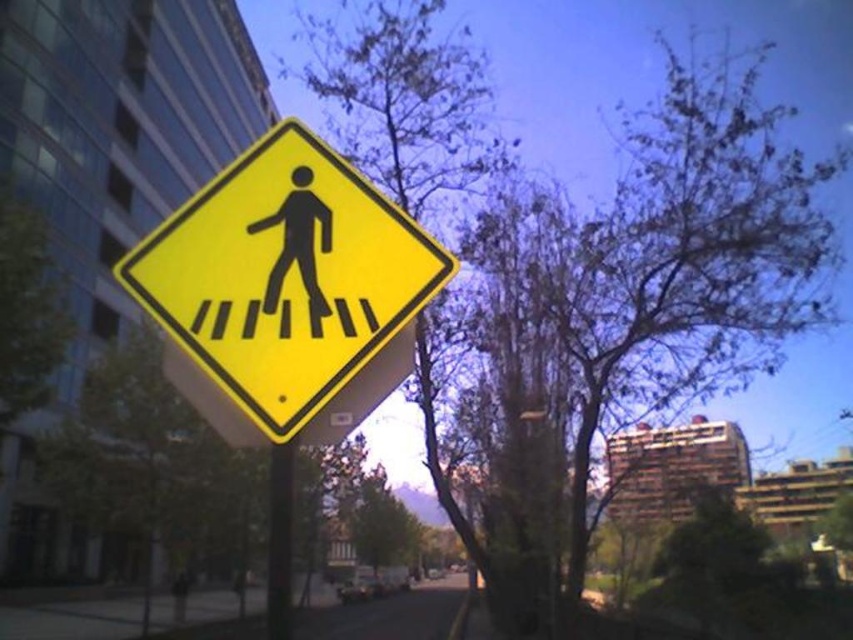
You are a pedestrian trying to cross the street and see the black silhouette at center on a yellow diamond sign. According to the sign, where should you walk to cross the street safely?

The black silhouette at center on the sign indicates the location of a designated pedestrian crossing area, so you should walk to that marked crossing to cross the street safely.

You are a city planner designing a new pedestrian sign. You have two objects in front of you, the black silhouette at center and the black plastic pole at center. Which object should you choose if you want a thinner design for the sign?

The black silhouette at center is thinner than the black plastic pole at center, so you should choose the black silhouette at center for a thinner design.

You are a delivery person carrying a large box that is 1.2 meters wide. You need to pass between the yellow matte pedestrian crossing sign at center and the black plastic pole at center. Can you fit through the space between them without tilting the box?

The yellow matte pedestrian crossing sign at center is 1.08 meters from the black plastic pole at center. Since the box is 1.2 meters wide, it is wider than the available space, so you cannot fit through without tilting the box.